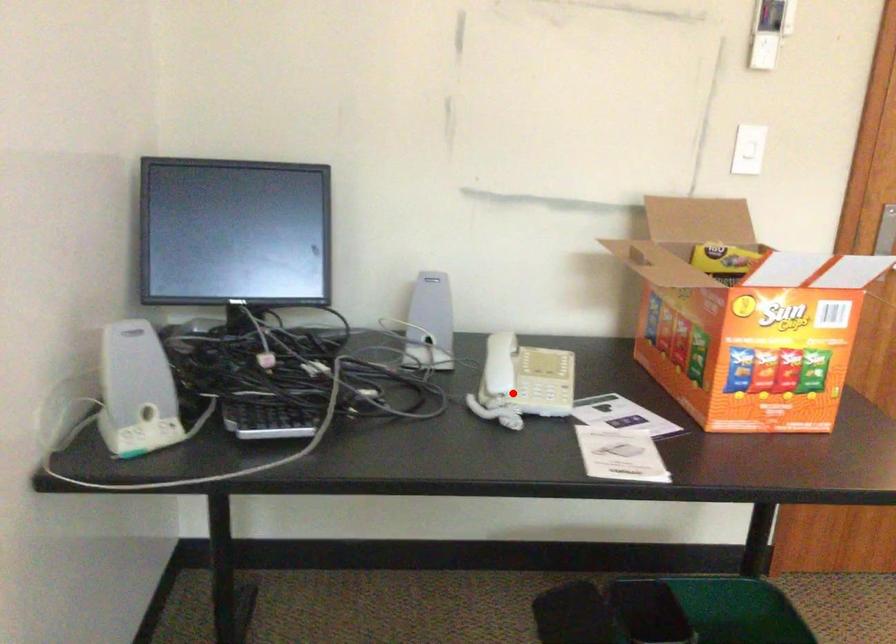
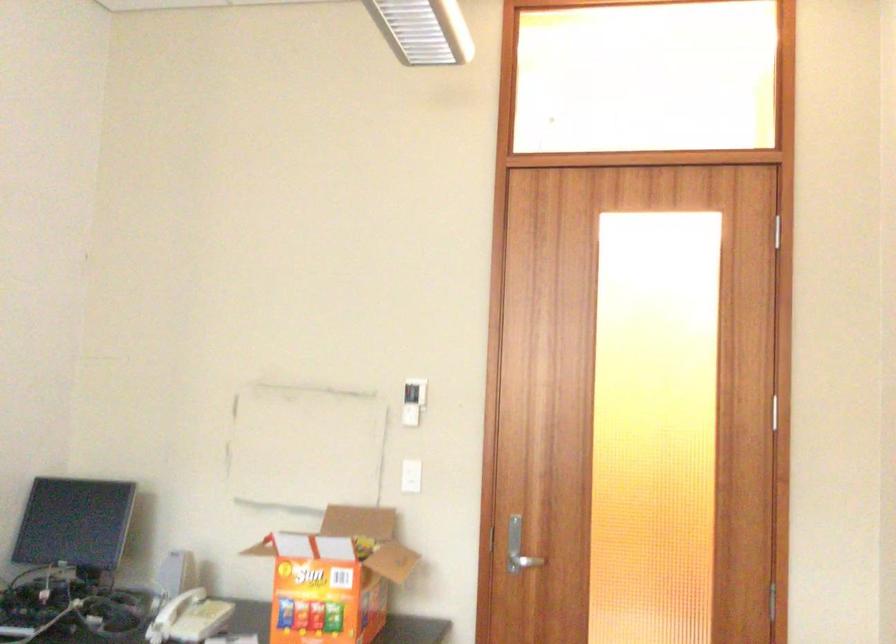
Question: I am providing you with two images of the same scene from different viewpoints. Given a red point in image1, look at the same physical point in image2. Is it:

Choices:
 (A) Closer to the viewpoint
 (B) Farther from the viewpoint

Answer: (B)